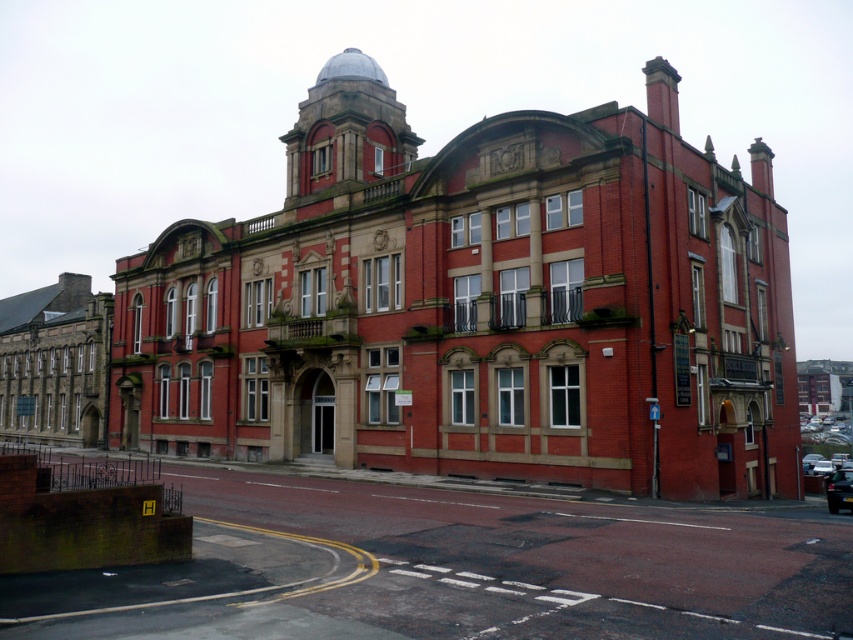
Based on the photo, you are a delivery person who needs to park a new car that is 2 meters wide. You see the black glossy car at center and the metallic silver car at center in the parking lot. Which car can you park next to without overlapping?

The black glossy car at center has a lesser width compared to metallic silver car at center, so the metallic silver car at center has more space next to it. You can park next to the metallic silver car at center.